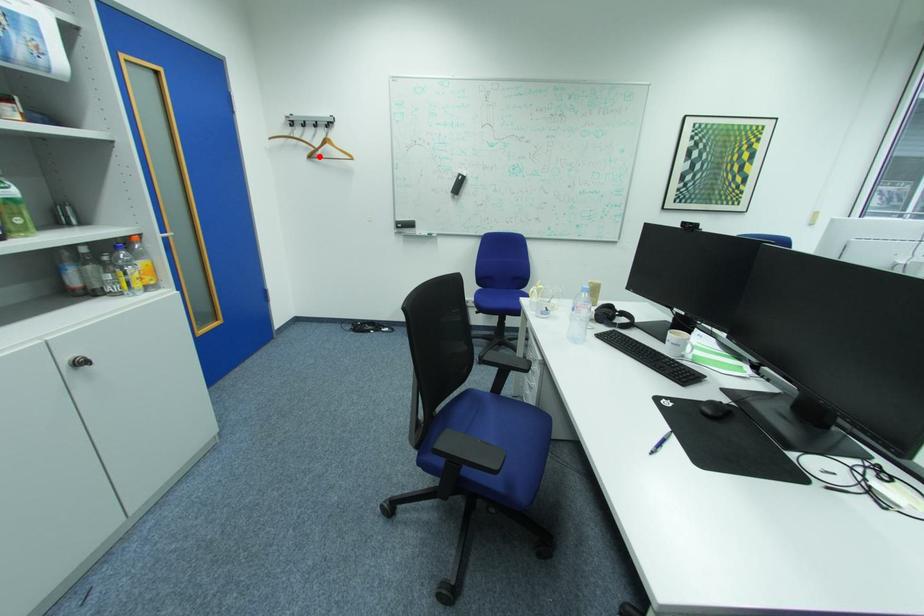
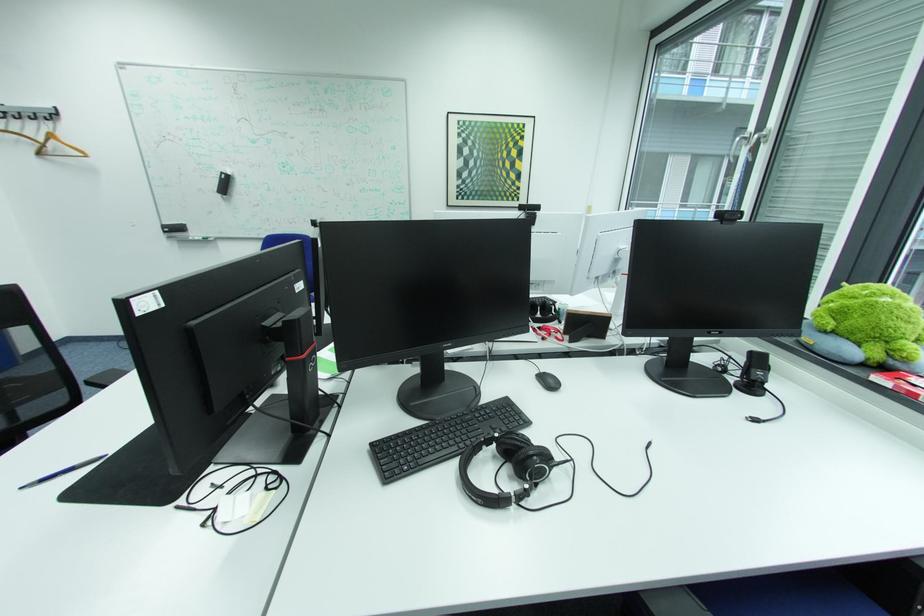
Find the pixel in the second image that matches the highlighted location in the first image.

(49, 153)